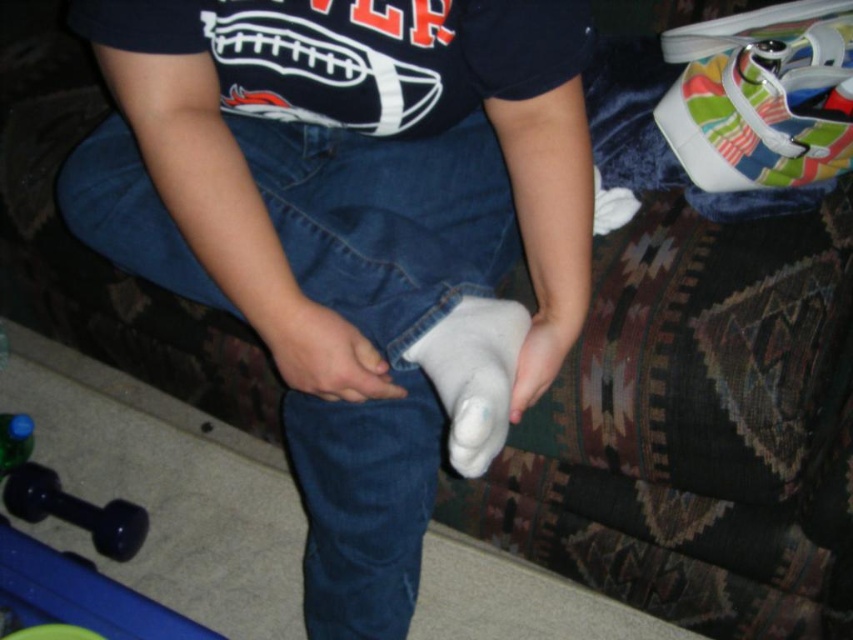
Question: Is white matte bandage at center smaller than rubberized black dumbbell at lower left?

Choices:
 (A) no
 (B) yes

Answer: (B)

Question: Which of the following is the farthest from the observer?

Choices:
 (A) (302, 433)
 (B) (444, 336)
 (C) (126, 538)

Answer: (C)

Question: Which is farther from the white matte cast at lower center?

Choices:
 (A) rubberized black dumbbell at lower left
 (B) white matte bandage at center
 (C) white matte hand at center

Answer: (A)

Question: Is white matte cast at lower center bigger than white soft sock at center?

Choices:
 (A) yes
 (B) no

Answer: (A)

Question: Considering the real-world distances, which object is farthest from the white matte hand at center?

Choices:
 (A) white matte bandage at center
 (B) white matte cast at lower center
 (C) white soft sock at center

Answer: (B)

Question: Does white matte cast at lower center have a smaller size compared to white matte hand at center?

Choices:
 (A) no
 (B) yes

Answer: (A)